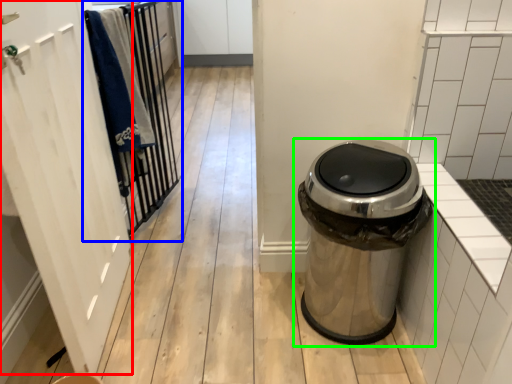
Question: Which object is positioned farthest from screen door (highlighted by a red box)? Select from closet (highlighted by a blue box) and waste container (highlighted by a green box).

Choices:
 (A) closet
 (B) waste container

Answer: (B)